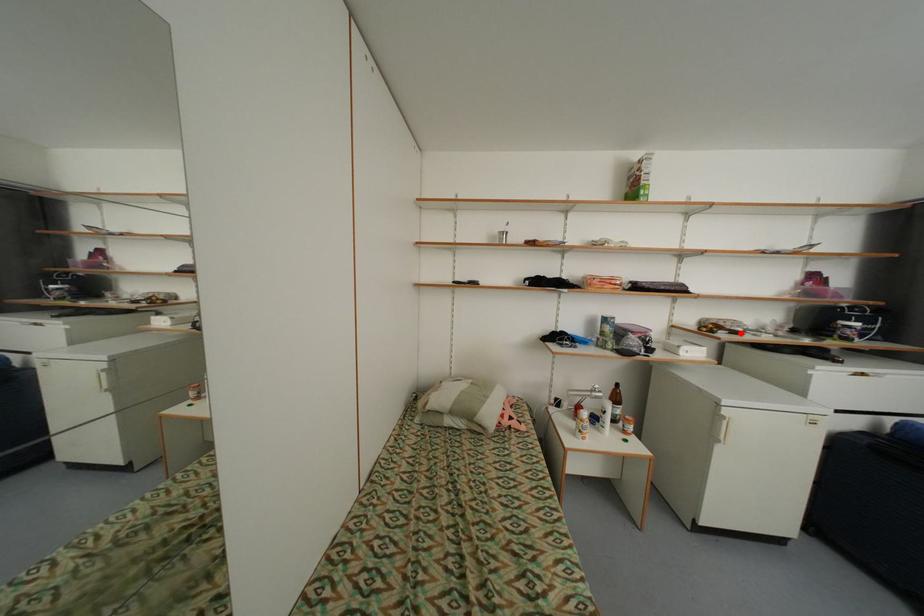
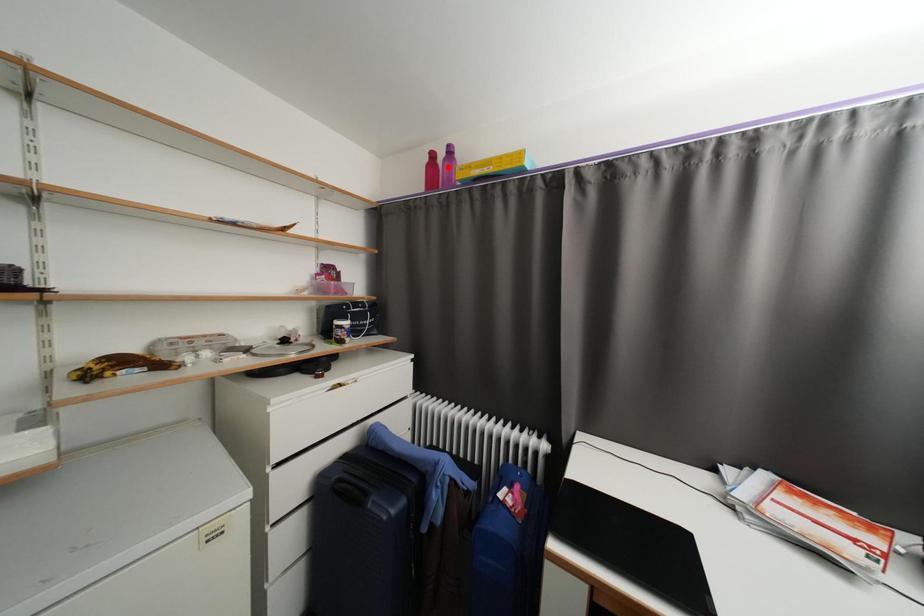
I am providing you with two images of the same scene from different viewpoints. A red point is marked on the first image and another point is marked on the second image. Is the marked point in image1 the same physical position as the marked point in image2?

No